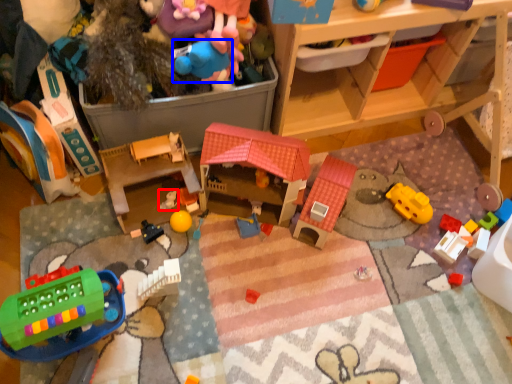
Question: Which point is further to the camera, toy (highlighted by a red box) or toy (highlighted by a blue box)?

Choices:
 (A) toy
 (B) toy

Answer: (A)